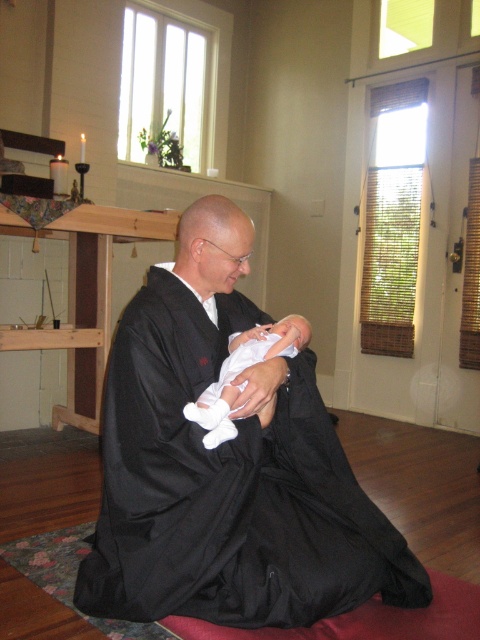
Question: Is white matte dress at center smaller than white soft fabric newborn at center?

Choices:
 (A) no
 (B) yes

Answer: (A)

Question: Does white matte dress at center come behind white soft fabric newborn at center?

Choices:
 (A) yes
 (B) no

Answer: (A)

Question: Which point appears closest to the camera in this image?

Choices:
 (A) (420, 580)
 (B) (223, 365)

Answer: (B)

Question: In this image, where is white matte dress at center located relative to white soft fabric newborn at center?

Choices:
 (A) right
 (B) left

Answer: (B)

Question: Which of the following is the farthest from the observer?

Choices:
 (A) (278, 330)
 (B) (334, 560)

Answer: (A)